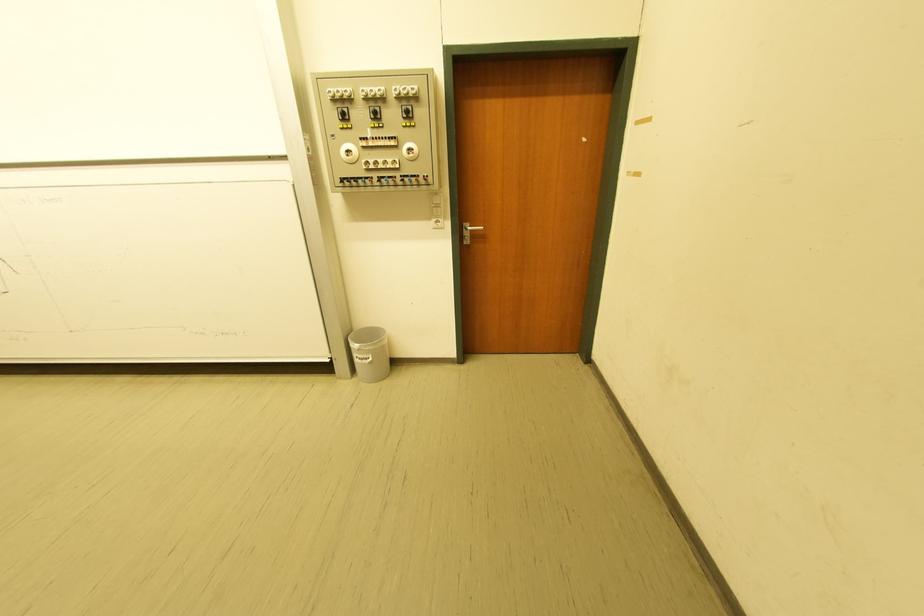
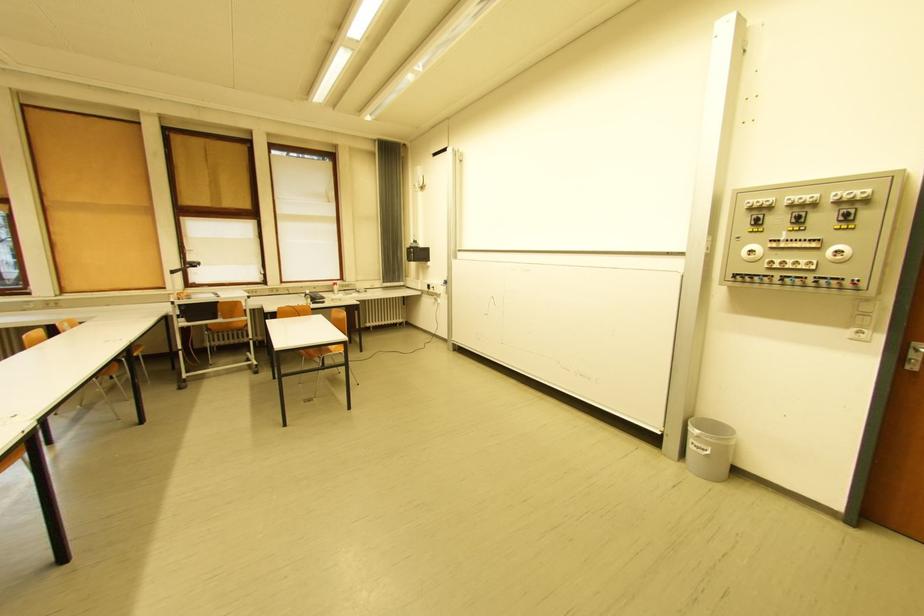
Question: Based on the continuous images, in which direction is the camera rotating? Reply with the corresponding letter.

Choices:
 (A) Left
 (B) Right
 (C) Up
 (D) Down

Answer: (A)